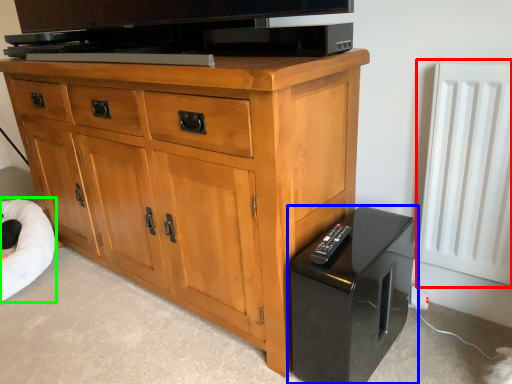
Question: Which object is the closest to the radiator (highlighted by a red box)? Choose among these: home appliance (highlighted by a blue box) or bean bag chair (highlighted by a green box).

Choices:
 (A) home appliance
 (B) bean bag chair

Answer: (A)